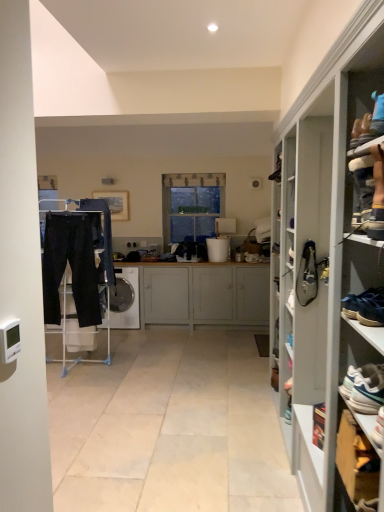
Question: Is clear glass window at center at the right side of wooden cabinet at lower right?

Choices:
 (A) yes
 (B) no

Answer: (B)

Question: Is clear glass window at center to the left of wooden cabinet at lower right from the viewer's perspective?

Choices:
 (A) yes
 (B) no

Answer: (A)

Question: From a real-world perspective, is clear glass window at center below wooden cabinet at lower right?

Choices:
 (A) yes
 (B) no

Answer: (B)

Question: Does clear glass window at center lie in front of wooden cabinet at lower right?

Choices:
 (A) no
 (B) yes

Answer: (A)

Question: From the image's perspective, is clear glass window at center located beneath wooden cabinet at lower right?

Choices:
 (A) no
 (B) yes

Answer: (A)

Question: Is clear glass window at center smaller than wooden cabinet at lower right?

Choices:
 (A) no
 (B) yes

Answer: (A)

Question: From a real-world perspective, is wooden cabinet at lower right under black leather shoe at right, which appears as the 2th shoe when viewed from the front?

Choices:
 (A) no
 (B) yes

Answer: (B)

Question: Is wooden cabinet at lower right with black leather shoe at right, marked as the first shoe in a back-to-front arrangement?

Choices:
 (A) no
 (B) yes

Answer: (A)

Question: Does wooden cabinet at lower right have a smaller size compared to black leather shoe at right, which appears as the 2th shoe when viewed from the front?

Choices:
 (A) no
 (B) yes

Answer: (A)

Question: Can you confirm if wooden cabinet at lower right is bigger than black leather shoe at right, positioned as the 2th shoe in bottom-to-top order?

Choices:
 (A) yes
 (B) no

Answer: (A)

Question: Considering the relative positions of wooden cabinet at lower right and black leather shoe at right, acting as the first shoe starting from the top, in the image provided, is wooden cabinet at lower right behind black leather shoe at right, acting as the first shoe starting from the top,?

Choices:
 (A) yes
 (B) no

Answer: (B)

Question: Is wooden cabinet at lower right far from black leather shoe at right, positioned as the 2th shoe in bottom-to-top order?

Choices:
 (A) no
 (B) yes

Answer: (B)

Question: Can you confirm if white glossy dishwasher at center is smaller than wooden cabinet at lower right?

Choices:
 (A) no
 (B) yes

Answer: (A)